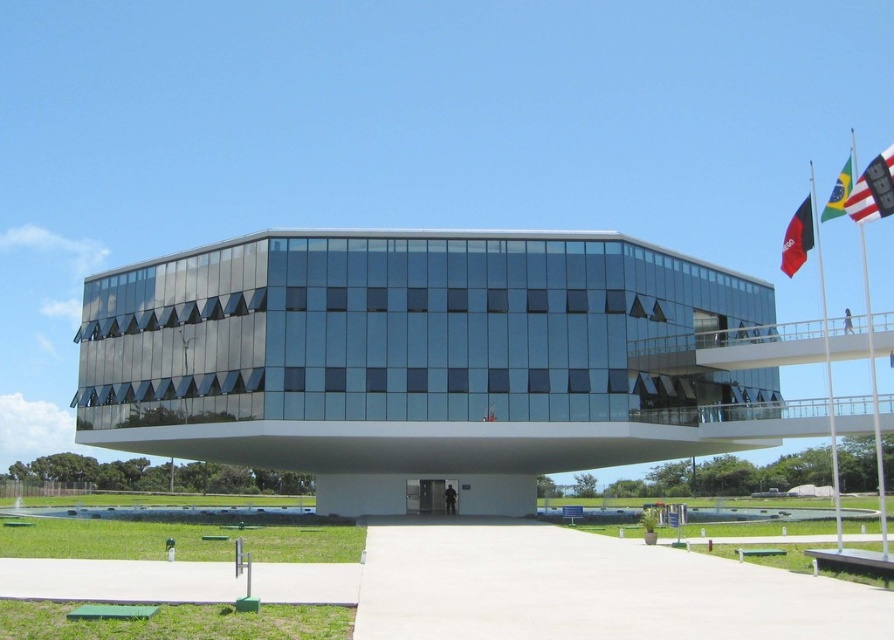
Question: Which of the following is the closest to the observer?

Choices:
 (A) polished metal flag pole at upper right
 (B) black fabric flag at upper right
 (C) green fabric flag at upper right

Answer: (A)

Question: Is the position of black flagpole at right less distant than that of green fabric flag at upper right?

Choices:
 (A) yes
 (B) no

Answer: (A)

Question: Is black flagpole at right thinner than black fabric flag at upper right?

Choices:
 (A) no
 (B) yes

Answer: (B)

Question: Is black flagpole at right in front of white fabric flag at upper right?

Choices:
 (A) yes
 (B) no

Answer: (B)

Question: Which of these objects is positioned closest to the green fabric flag at upper right?

Choices:
 (A) black fabric flag at upper right
 (B) polished metal flag pole at upper right
 (C) black flagpole at right
 (D) white fabric flag at upper right

Answer: (D)

Question: Estimate the real-world distances between objects in this image. Which object is farther from the black fabric flag at upper right?

Choices:
 (A) green fabric flag at upper right
 (B) polished metal flag pole at upper right

Answer: (B)